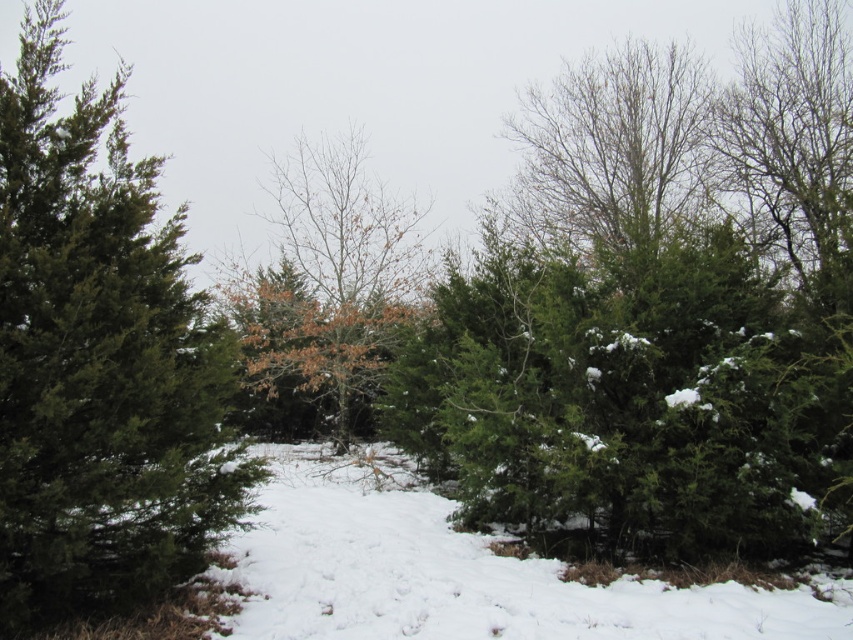
Is white fluffy snow at center smaller than bare branches at center?

Yes.

Which is below, white fluffy snow at center or bare branches at center?

white fluffy snow at center

Image resolution: width=853 pixels, height=640 pixels. What are the coordinates of `white fluffy snow at center` in the screenshot? It's located at (461, 576).

Locate an element on the screen. This screenshot has height=640, width=853. white fluffy snow at center is located at coordinates (461, 576).

Which of these two, green matte evergreen tree at left or bare branches at center, stands taller?

With more height is bare branches at center.

Consider the image. Measure the distance between point (80,333) and camera.

A distance of 3.76 meters exists between point (80,333) and camera.

The height and width of the screenshot is (640, 853). I want to click on green matte evergreen tree at left, so click(99, 362).

Does green matte evergreen tree at left have a smaller size compared to white fluffy snow at center?

No, green matte evergreen tree at left is not smaller than white fluffy snow at center.

Is point (15, 161) in front of point (363, 541)?

Yes.

Which is behind, point (9, 500) or point (398, 627)?

The point (398, 627) is more distant.

You are a GUI agent. You are given a task and a screenshot of the screen. Output one action in this format:
    pyautogui.click(x=<x>, y=<y>)
    Task: Click on the green matte evergreen tree at left
    This screenshot has height=640, width=853.
    Given the screenshot: What is the action you would take?
    pyautogui.click(x=99, y=362)